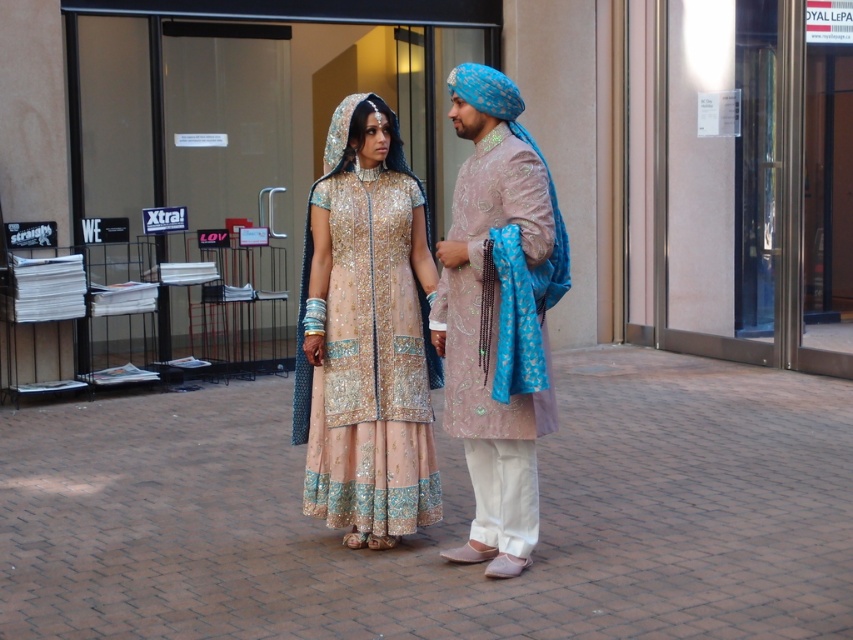
You are standing at the entrance of the building with glass doors. You need to locate the matte pink kurta at center. Based on the coordinates provided, where should you look to find it?

The matte pink kurta at center is located at coordinates point (498, 316), which is near the center of the image.

You are a photographer setting up a shoot in the scene described. You need to place a 30cm tall tripod between the brick pavement at center and the pale pink embroidered dress at center. Which object should the tripod be placed closer to to ensure it doesn

The brick pavement at center is not as tall as the pale pink embroidered dress at center. Therefore, the tripod should be placed closer to the brick pavement at center to ensure stability and visibility.